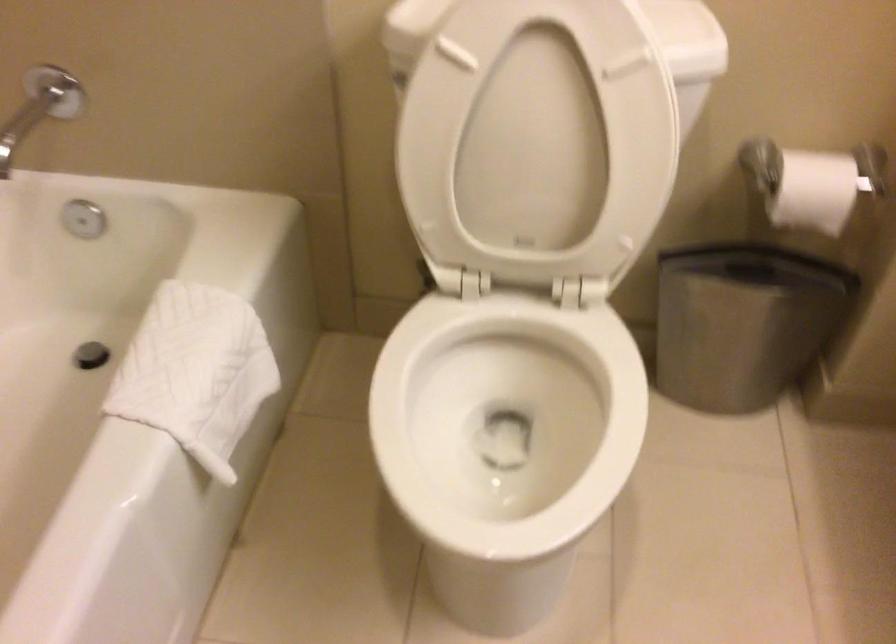
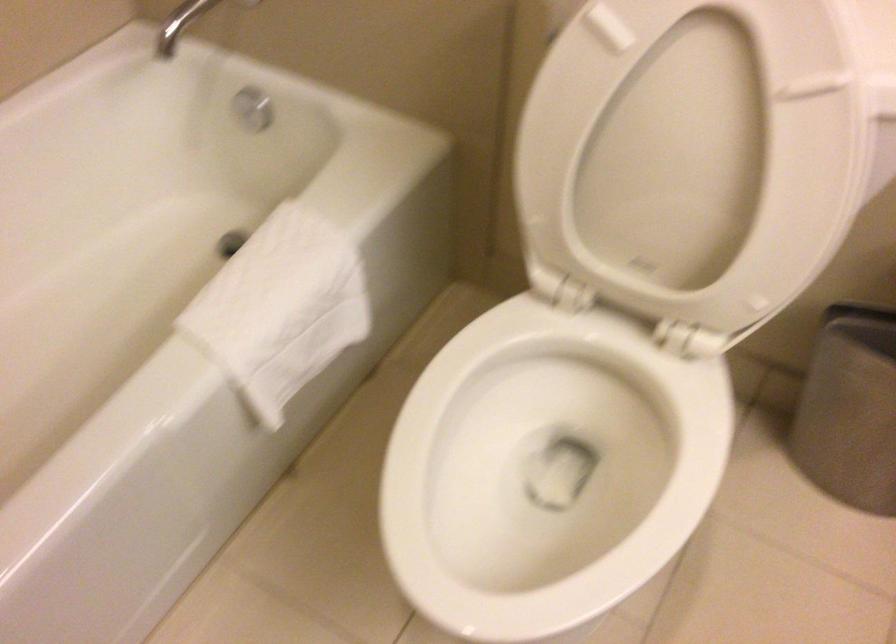
Where in the second image is the point corresponding to (x=543, y=134) from the first image?

(691, 154)